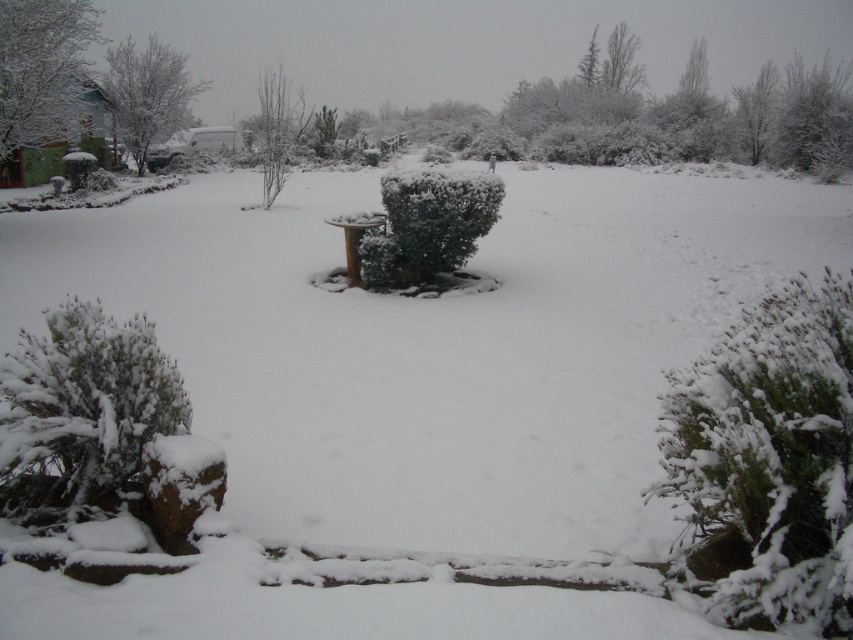
Question: Does bare branches at center have a larger size compared to green textured tree at upper center?

Choices:
 (A) no
 (B) yes

Answer: (B)

Question: Considering the relative positions of green matte house at upper left and green textured tree at upper center in the image provided, where is green matte house at upper left located with respect to green textured tree at upper center?

Choices:
 (A) right
 (B) left

Answer: (B)

Question: Which of the following is the farthest from the observer?

Choices:
 (A) (619, 83)
 (B) (477, 202)
 (C) (158, 406)
 (D) (587, 52)

Answer: (D)

Question: Which is farther from the white fluffy bush at lower left?

Choices:
 (A) green fuzzy bush at lower right
 (B) green leafy tree at upper center
 (C) snow-covered tree at upper left
 (D) bare branches at center

Answer: (B)

Question: Which of these objects is positioned closest to the white fluffy bush at lower left?

Choices:
 (A) snow-covered tree at upper left
 (B) green leafy tree at upper center
 (C) green textured tree at upper center
 (D) green fuzzy bush at lower right

Answer: (D)

Question: Can you confirm if snow-covered tree at upper left is positioned to the right of green textured tree at upper center?

Choices:
 (A) yes
 (B) no

Answer: (B)